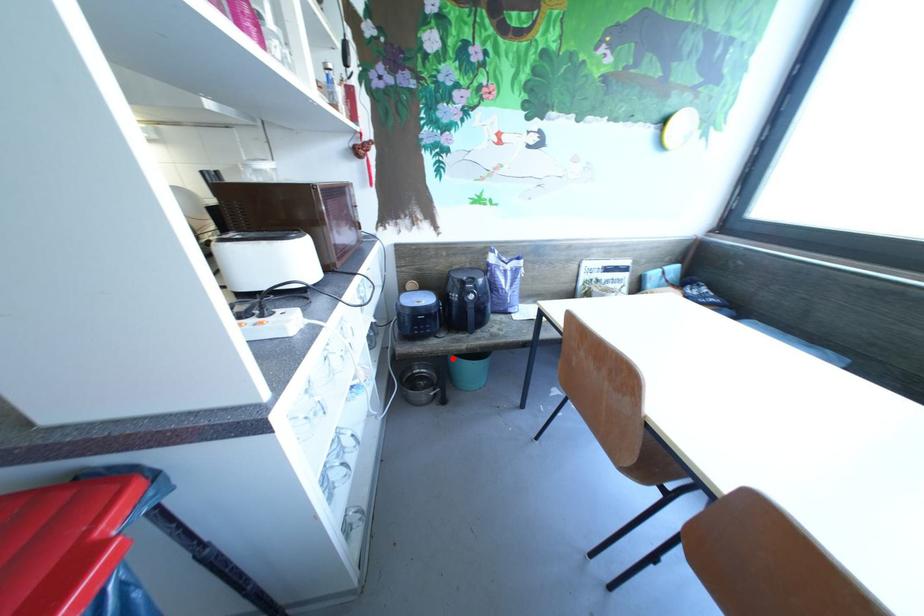
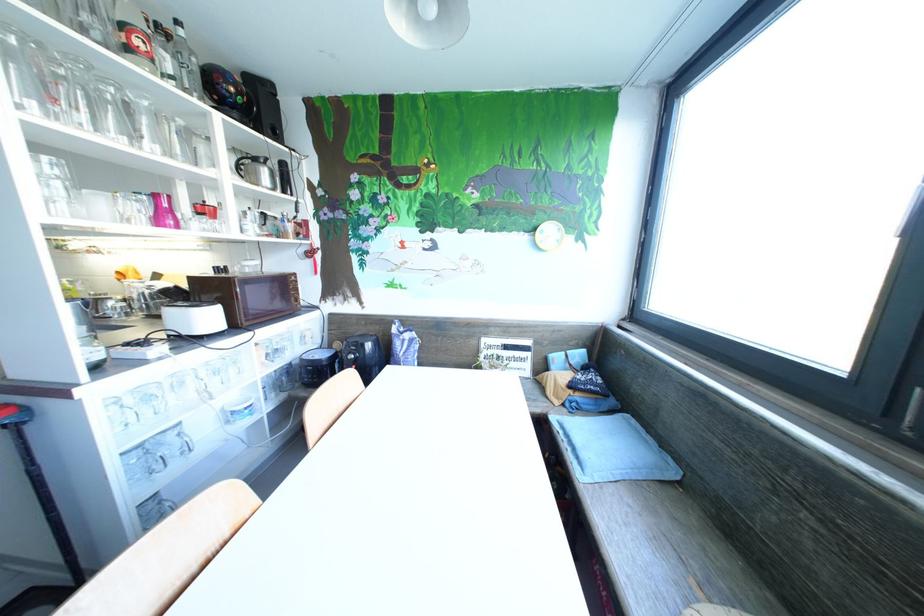
Question: I am providing you with two images of the same scene from different viewpoints. A red point is marked on the first image. At the location where the point appears in image 1, is it still visible in image 2?

Choices:
 (A) Yes
 (B) No

Answer: (B)